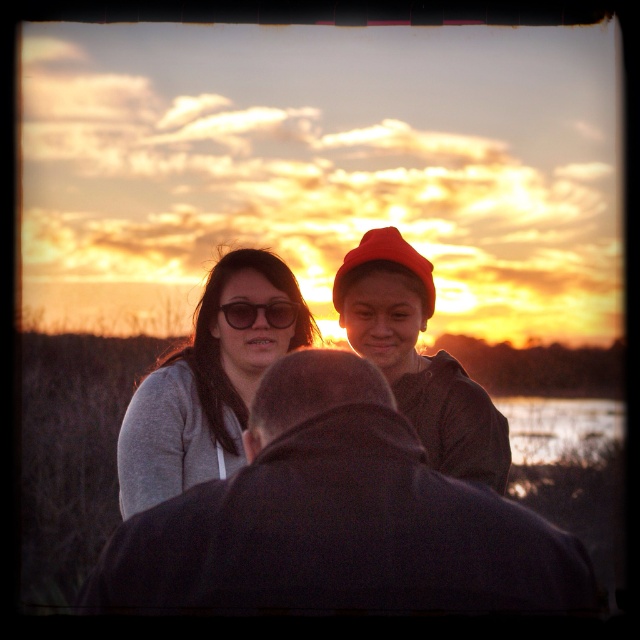
Question: Observing the image, what is the correct spatial positioning of matte gray sweater at center in reference to red woolen beanie at upper center?

Choices:
 (A) right
 (B) left

Answer: (B)

Question: Which point is closer to the camera taking this photo?

Choices:
 (A) (x=358, y=262)
 (B) (x=509, y=554)
 (C) (x=486, y=413)
 (D) (x=195, y=396)

Answer: (B)

Question: Can you confirm if red woolen beanie at upper center is positioned to the right of matte black sunglasses at center?

Choices:
 (A) no
 (B) yes

Answer: (B)

Question: Based on their relative distances, which object is farther from the dark gray jacket at center?

Choices:
 (A) matte black sunglasses at center
 (B) matte red beanie at center
 (C) red woolen beanie at upper center

Answer: (A)

Question: Based on their relative distances, which object is nearer to the matte black sunglasses at center?

Choices:
 (A) matte red beanie at center
 (B) matte gray sweater at center
 (C) matte gray sweater at left
 (D) dark gray jacket at center

Answer: (C)

Question: Considering the relative positions of dark gray jacket at center and red woolen beanie at upper center in the image provided, where is dark gray jacket at center located with respect to red woolen beanie at upper center?

Choices:
 (A) above
 (B) below

Answer: (B)